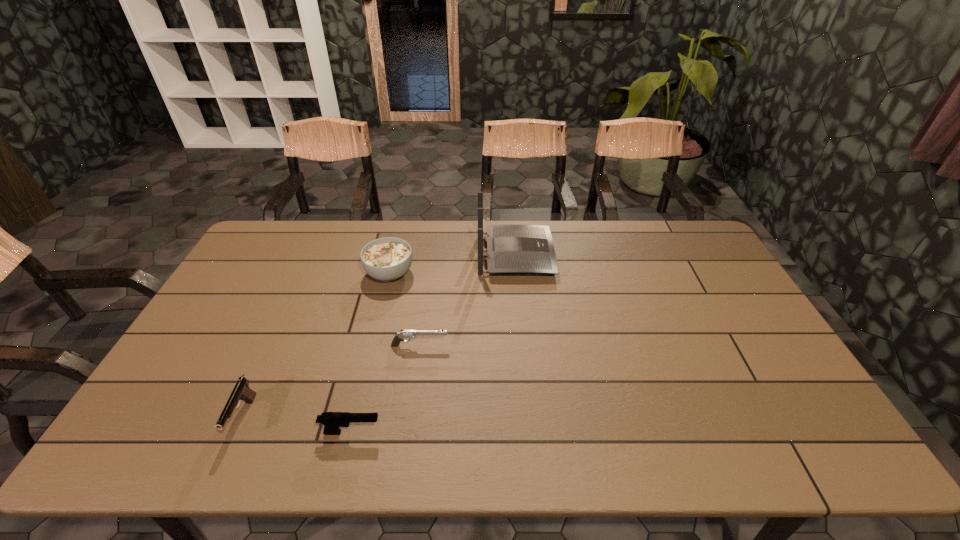
The height and width of the screenshot is (540, 960). I want to click on soup bowl present at the far edge, so pyautogui.click(x=387, y=259).

In the image, there is a desktop. Identify the location of free space at the far edge. [x=468, y=231].

Locate an element on the screen. The height and width of the screenshot is (540, 960). vacant space at the near edge is located at coordinates (511, 451).

In the image, there is a desktop. At what (x,y) coordinates should I click in order to perform the action: click on vacant space at the left edge. Please return your answer as a coordinate pair (x, y). Looking at the image, I should click on click(289, 262).

This screenshot has width=960, height=540. Identify the location of empty location between the router and the shortest object. (468, 301).

Where is `vacant area that lies between the tallest object and the soup bowl`? Image resolution: width=960 pixels, height=540 pixels. vacant area that lies between the tallest object and the soup bowl is located at coordinates (452, 265).

Locate an element on the screen. vacant point located between the tallest object and the farthest pistol is located at coordinates (468, 301).

Identify the location of empty location between the third nearest object and the soup bowl. The image size is (960, 540). (405, 309).

Identify the location of empty location between the tallest object and the leftmost object. (379, 336).

Find the location of a particular element. Image resolution: width=960 pixels, height=540 pixels. unoccupied area between the third farthest object and the rightmost object is located at coordinates (468, 301).